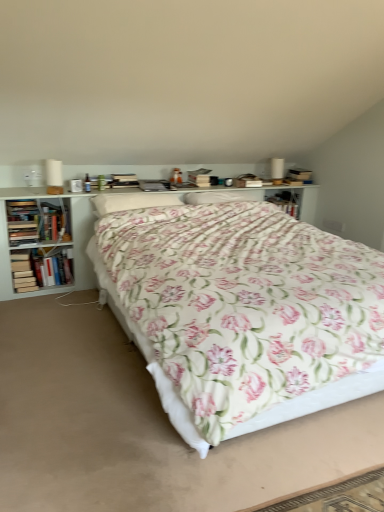
What do you see at coordinates (53, 223) in the screenshot?
I see `hardcover book at left, arranged as the 3th book when ordered from the bottom` at bounding box center [53, 223].

In the scene shown: What is the approximate width of hardcover book at left, which is counted as the 3th book, starting from the top?

The width of hardcover book at left, which is counted as the 3th book, starting from the top, is 9.99 inches.

Find the location of a particular element. floral fabric bed at center is located at coordinates point(243,312).

What do you see at coordinates (131, 201) in the screenshot? I see `white soft pillow at center` at bounding box center [131, 201].

Find the location of a particular element. The width and height of the screenshot is (384, 512). hardcover book at left, which is the 1th book from top to bottom is located at coordinates (53, 223).

Considering the positions of objects hardcover book at left, the second book viewed from the top, and floral fabric bed at center in the image provided, who is in front, hardcover book at left, the second book viewed from the top, or floral fabric bed at center?

floral fabric bed at center.

Consider the image. Can you tell me how much hardcover book at left, the second book viewed from the top, and floral fabric bed at center differ in facing direction?

The facing directions of hardcover book at left, the second book viewed from the top, and floral fabric bed at center are 0.00166 degrees apart.

Is hardcover book at left, the second book viewed from the top, turned away from floral fabric bed at center?

No.

From the picture: Which is less distant, (70, 275) or (260, 281)?

Point (70, 275) appears to be farther away from the viewer than point (260, 281).

In the scene shown: From the image's perspective, would you say hardcover book at left, which is counted as the 3th book, starting from the top, is shown under floral fabric bed at center?

No, from the image's perspective, hardcover book at left, which is counted as the 3th book, starting from the top, is not beneath floral fabric bed at center.

Which object is further away from the camera, hardcover book at left, the first book in the bottom-to-top sequence, or floral fabric bed at center?

Positioned behind is hardcover book at left, the first book in the bottom-to-top sequence.

Considering the sizes of objects hardcover book at left, which is counted as the 3th book, starting from the top, and floral fabric bed at center in the image provided, who is shorter, hardcover book at left, which is counted as the 3th book, starting from the top, or floral fabric bed at center?

Standing shorter between the two is hardcover book at left, which is counted as the 3th book, starting from the top.

Considering the points (26, 259) and (185, 407), which point is behind, point (26, 259) or point (185, 407)?

The point (26, 259) is behind.

What's the angular difference between hardcover book at left, the first book in the bottom-to-top sequence, and white soft pillow at center's facing directions?

The facing directions of hardcover book at left, the first book in the bottom-to-top sequence, and white soft pillow at center are 0.00203 degrees apart.

Which of these two, hardcover book at left, the first book in the bottom-to-top sequence, or white soft pillow at center, is smaller?

With smaller size is hardcover book at left, the first book in the bottom-to-top sequence.

In the scene shown: Is hardcover book at left, the first book in the bottom-to-top sequence, in front of or behind white soft pillow at center in the image?

Visually, hardcover book at left, the first book in the bottom-to-top sequence, is located behind white soft pillow at center.

From a real-world perspective, which object rests below the other?

white wood bookcase at center is physically lower.

From the image's perspective, is hardcover book at left, arranged as the 3th book when ordered from the bottom, over white wood bookcase at center?

Yes, from the image's perspective, hardcover book at left, arranged as the 3th book when ordered from the bottom, is above white wood bookcase at center.

Is hardcover book at left, arranged as the 3th book when ordered from the bottom, placed right next to white wood bookcase at center?

hardcover book at left, arranged as the 3th book when ordered from the bottom, and white wood bookcase at center are not in contact.

Is hardcover book at left, arranged as the 3th book when ordered from the bottom, behind white wood bookcase at center?

Yes, it is behind white wood bookcase at center.

Can hardcover book at left, arranged as the 3th book when ordered from the bottom, be found inside white wood bookcase at center?

Yes, white wood bookcase at center is surrounding hardcover book at left, arranged as the 3th book when ordered from the bottom.

From the image's perspective, is white wood bookcase at center above hardcover book at left, arranged as the 3th book when ordered from the bottom?

Actually, white wood bookcase at center appears below hardcover book at left, arranged as the 3th book when ordered from the bottom, in the image.

Is white wood bookcase at center in contact with hardcover book at left, which is the 1th book from top to bottom?

No, white wood bookcase at center is not making contact with hardcover book at left, which is the 1th book from top to bottom.

Is white wood bookcase at center facing away from hardcover book at left, arranged as the 3th book when ordered from the bottom?

Absolutely, white wood bookcase at center is directed away from hardcover book at left, arranged as the 3th book when ordered from the bottom.

Based on their sizes in the image, would you say white soft pillow at center is bigger or smaller than hardcover book at left, the second book viewed from the top?

white soft pillow at center is bigger than hardcover book at left, the second book viewed from the top.

In the scene shown: From the image's perspective, which object appears higher, white soft pillow at center or hardcover book at left, the second book viewed from the top?

white soft pillow at center is shown above in the image.

Is point (103, 202) farther from viewer compared to point (51, 277)?

No, (103, 202) is closer to viewer.

Is white wood bookcase at center facing away from white soft pillow at center?

No, white soft pillow at center is not at the back of white wood bookcase at center.

Considering the sizes of objects white wood bookcase at center and white soft pillow at center in the image provided, who is taller, white wood bookcase at center or white soft pillow at center?

white wood bookcase at center.

Is white wood bookcase at center bigger than white soft pillow at center?

Indeed, white wood bookcase at center has a larger size compared to white soft pillow at center.

Identify the location of bed in front of the hardcover book at left, the second book viewed from the top. Image resolution: width=384 pixels, height=512 pixels. (243, 312).

What are the coordinates of `bed below the hardcover book at left, the first book in the bottom-to-top sequence (from the image's perspective)` in the screenshot? It's located at (243, 312).

Which object lies further to the anchor point white soft pillow at center, hardcover book at left, which is the 1th book from top to bottom, or hardcover book at left, the second book viewed from the top?

Among the two, hardcover book at left, the second book viewed from the top, is located further to white soft pillow at center.

Looking at the image, which one is located closer to white wood bookcase at center, floral fabric bed at center or white soft pillow at center?

Among the two, white soft pillow at center is located nearer to white wood bookcase at center.

From the image, which object appears to be nearer to white soft pillow at center, hardcover book at left, the first book in the bottom-to-top sequence, or hardcover book at left, the second book when ordered from bottom to top?

hardcover book at left, the second book when ordered from bottom to top, is closer to white soft pillow at center.

From the image, which object appears to be farther from hardcover book at left, the second book when ordered from bottom to top, floral fabric bed at center or hardcover book at left, which is the 1th book from top to bottom?

floral fabric bed at center.

Estimate the real-world distances between objects in this image. Which object is further from hardcover book at left, arranged as the 3th book when ordered from the bottom, white wood bookcase at center or floral fabric bed at center?

floral fabric bed at center lies further to hardcover book at left, arranged as the 3th book when ordered from the bottom, than the other object.

Estimate the real-world distances between objects in this image. Which object is closer to white wood bookcase at center, hardcover book at left, which is counted as the 3th book, starting from the top, or floral fabric bed at center?

hardcover book at left, which is counted as the 3th book, starting from the top, lies closer to white wood bookcase at center than the other object.

Considering their positions, is white soft pillow at center positioned closer to hardcover book at left, arranged as the 3th book when ordered from the bottom, than hardcover book at left, the second book viewed from the top?

Based on the image, hardcover book at left, the second book viewed from the top, appears to be nearer to hardcover book at left, arranged as the 3th book when ordered from the bottom.

From the image, which object appears to be nearer to hardcover book at left, the second book viewed from the top, white wood bookcase at center or white soft pillow at center?

white wood bookcase at center is positioned closer to the anchor hardcover book at left, the second book viewed from the top.

At what (x,y) coordinates should I click in order to perform the action: click on pillow between hardcover book at left, the second book viewed from the top, and white wood bookcase at center. Please return your answer as a coordinate pair (x, y). Looking at the image, I should click on (131, 201).

Image resolution: width=384 pixels, height=512 pixels. What are the coordinates of `bookcase between floral fabric bed at center and hardcover book at left, which is counted as the 3th book, starting from the top, from front to back` in the screenshot? It's located at (6, 221).

In order to click on book between hardcover book at left, the second book when ordered from bottom to top, and white wood bookcase at center from left to right in this screenshot , I will do `click(53, 223)`.

I want to click on bookcase between floral fabric bed at center and hardcover book at left, the second book viewed from the top, along the z-axis, so click(6, 221).